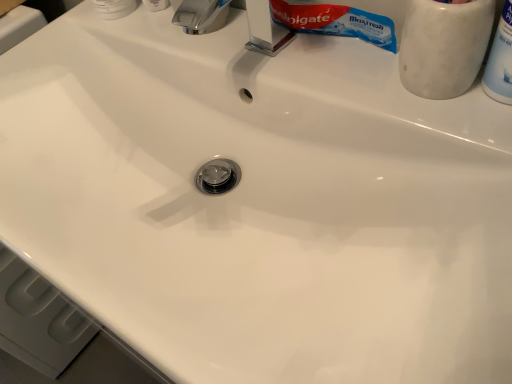
Where is `vacant space that is in between chrome metallic faucet at upper center and white plastic toothpaste tube at upper left, which ranks as the first toiletry in left-to-right order`? Image resolution: width=512 pixels, height=384 pixels. vacant space that is in between chrome metallic faucet at upper center and white plastic toothpaste tube at upper left, which ranks as the first toiletry in left-to-right order is located at coordinates (157, 26).